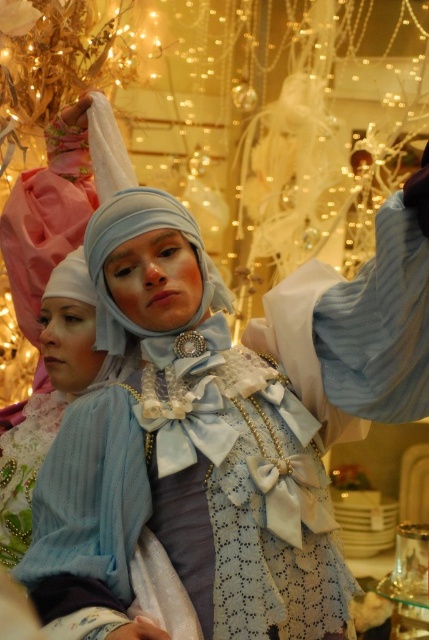
You are a costume designer trying to decide which item to store first in a limited space. Given the two items, the matte blue fabric dress at center and the light blue fabric headdress at center, which one requires more storage space?

The matte blue fabric dress at center requires more storage space because it is larger in size than the light blue fabric headdress at center.

You are a costume designer working on a play. You need to ensure that the matte blue fabric dress at center and the light blue fabric headdress at center are arranged correctly in the scene. According to the image, which object is positioned lower in the scene?

The matte blue fabric dress at center is located below the light blue fabric headdress at center, so the dress is positioned lower in the scene.